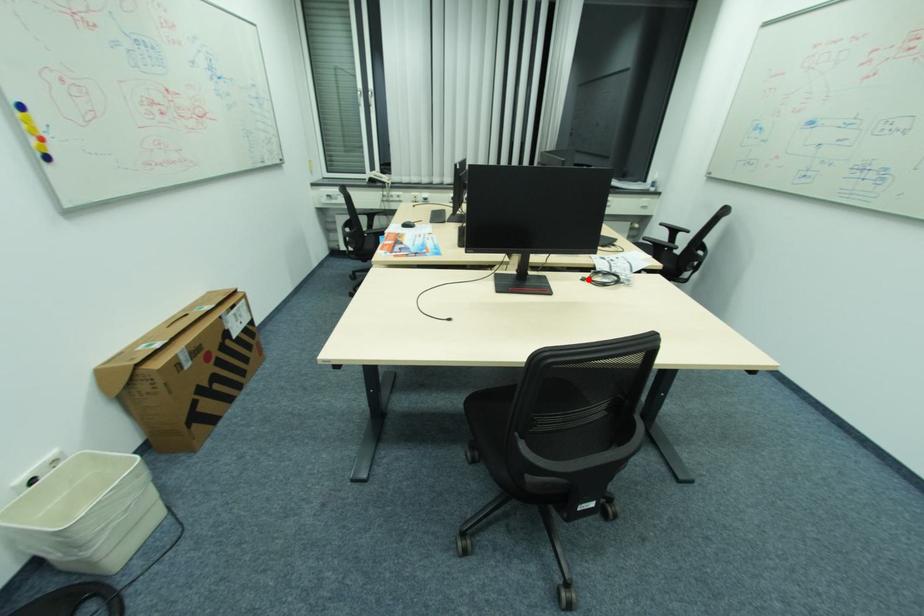
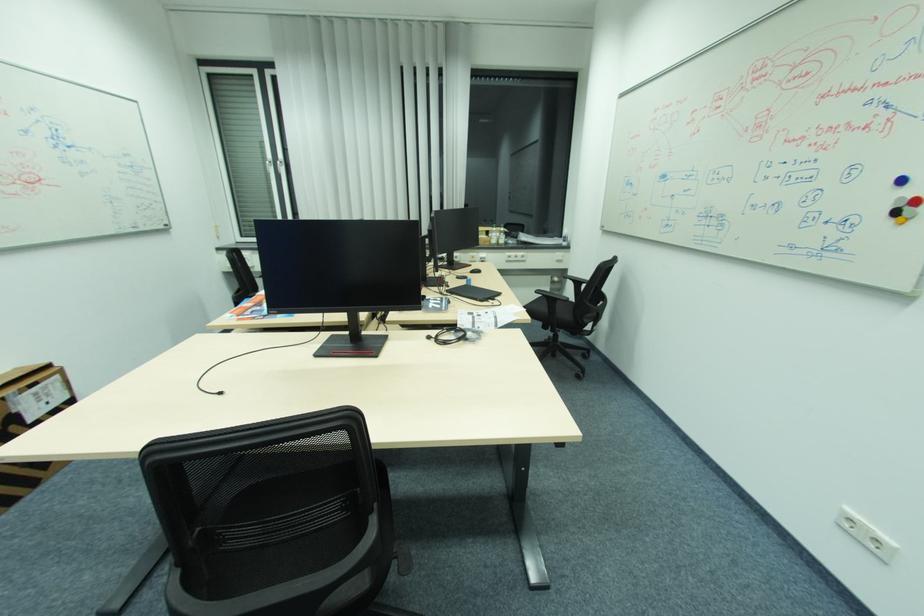
Question: I am providing you with two images of the same scene from different viewpoints. A red point is marked on the first image. At the location where the point appears in image 1, is it still visible in image 2?

Choices:
 (A) Yes
 (B) No

Answer: (A)